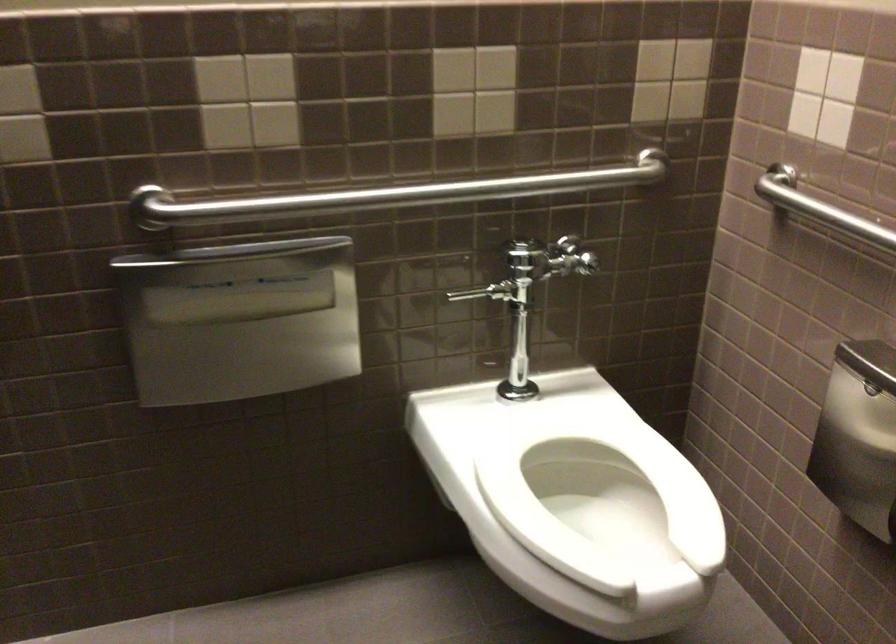
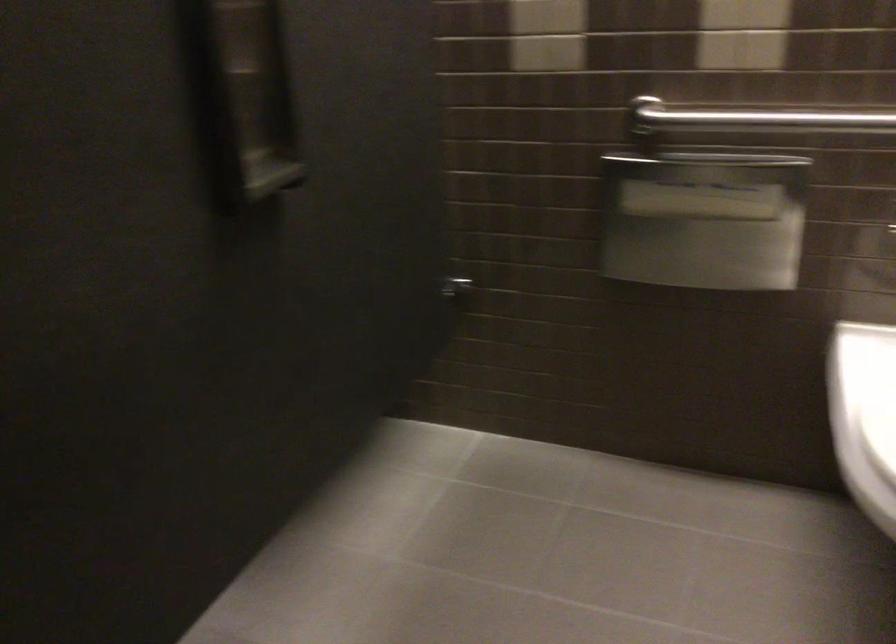
In the second image, find the point that corresponds to (254,319) in the first image.

(703, 220)